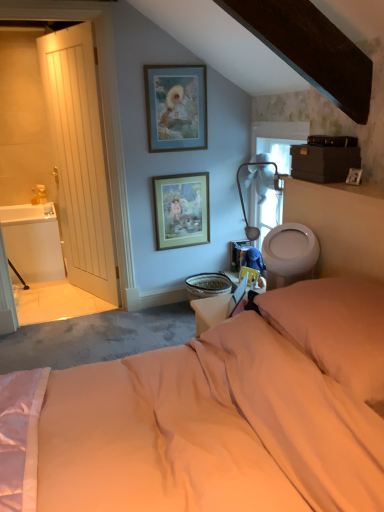
How much space does blue matte picture frame at upper center, which is the 2th picture frame in bottom-to-top order, occupy horizontally?

It is 0.93 inches.

The height and width of the screenshot is (512, 384). What do you see at coordinates (176, 106) in the screenshot? I see `blue matte picture frame at upper center, which ranks as the first picture frame in top-to-bottom order` at bounding box center [176, 106].

What do you see at coordinates (259, 185) in the screenshot? I see `white fabric lampshade at upper center` at bounding box center [259, 185].

You are a GUI agent. You are given a task and a screenshot of the screen. Output one action in this format:
    pyautogui.click(x=<x>, y=<y>)
    Task: Click on the soft pink pillow at lower right
    
    Given the screenshot: What is the action you would take?
    pyautogui.click(x=334, y=329)

Is soft pink pillow at lower right spatially inside wooden framed print at center, the 2th picture frame when ordered from top to bottom, or outside of it?

The correct answer is: outside.

Which object is further away from the camera, soft pink pillow at lower right or wooden framed print at center, the 2th picture frame when ordered from top to bottom?

wooden framed print at center, the 2th picture frame when ordered from top to bottom, is behind.

Is soft pink pillow at lower right oriented towards wooden framed print at center, the 2th picture frame when ordered from top to bottom?

No, soft pink pillow at lower right is not oriented towards wooden framed print at center, the 2th picture frame when ordered from top to bottom.

Is white glossy sink at left wider than soft pink pillow at lower right?

Yes, white glossy sink at left is wider than soft pink pillow at lower right.

Is white glossy sink at left situated inside soft pink pillow at lower right or outside?

white glossy sink at left exists outside the volume of soft pink pillow at lower right.

Is white glossy sink at left oriented away from soft pink pillow at lower right?

white glossy sink at left is not turned away from soft pink pillow at lower right.

From a real-world perspective, who is located higher, white glossy sink at left or soft pink pillow at lower right?

In real-world perspective, soft pink pillow at lower right is above.

Consider the image. Does wooden framed print at center, the 2th picture frame when ordered from top to bottom, have a greater height compared to white fabric lampshade at upper center?

Yes, wooden framed print at center, the 2th picture frame when ordered from top to bottom, is taller than white fabric lampshade at upper center.

Between wooden framed print at center, arranged as the first picture frame when ordered from the bottom, and white fabric lampshade at upper center, which one has smaller size?

wooden framed print at center, arranged as the first picture frame when ordered from the bottom.

Which object is more forward, wooden framed print at center, the 2th picture frame when ordered from top to bottom, or white fabric lampshade at upper center?

white fabric lampshade at upper center is closer to the camera.

Is wooden framed print at center, the 2th picture frame when ordered from top to bottom, facing towards white fabric lampshade at upper center?

Yes, wooden framed print at center, the 2th picture frame when ordered from top to bottom, is turned towards white fabric lampshade at upper center.

Is blue matte picture frame at upper center, which ranks as the first picture frame in top-to-bottom order, bigger than white glossy sink at left?

Actually, blue matte picture frame at upper center, which ranks as the first picture frame in top-to-bottom order, might be smaller than white glossy sink at left.

From a real-world perspective, is blue matte picture frame at upper center, which is the 2th picture frame in bottom-to-top order, under white glossy sink at left?

Actually, blue matte picture frame at upper center, which is the 2th picture frame in bottom-to-top order, is physically above white glossy sink at left in the real world.

Could white glossy sink at left be considered to be inside blue matte picture frame at upper center, which ranks as the first picture frame in top-to-bottom order?

No, white glossy sink at left is not surrounded by blue matte picture frame at upper center, which ranks as the first picture frame in top-to-bottom order.

Which object is thinner, blue matte picture frame at upper center, which ranks as the first picture frame in top-to-bottom order, or white glossy sink at left?

Thinner between the two is blue matte picture frame at upper center, which ranks as the first picture frame in top-to-bottom order.

Does white glossy sink at left have a smaller size compared to white wooden door at left?

Actually, white glossy sink at left might be larger than white wooden door at left.

Where is `door in front of the white glossy sink at left`? The image size is (384, 512). door in front of the white glossy sink at left is located at coordinates (79, 158).

Which object is more forward, white glossy sink at left or white wooden door at left?

white wooden door at left is closer to the camera.

Can you tell me how much white glossy sink at left and white wooden door at left differ in facing direction?

The angle between the facing direction of white glossy sink at left and the facing direction of white wooden door at left is 64.7 degrees.

At what (x,y) coordinates should I click in order to perform the action: click on pillow lying in front of the white glossy toilet bowl at right. Please return your answer as a coordinate pair (x, y). This screenshot has height=512, width=384. Looking at the image, I should click on (334, 329).

Is point (279, 281) positioned before point (341, 364)?

No, it is not.

Does white glossy toilet bowl at right have a lesser width compared to soft pink pillow at lower right?

Yes, white glossy toilet bowl at right is thinner than soft pink pillow at lower right.

Locate an element on the screen. The height and width of the screenshot is (512, 384). picture frame below the white fabric lampshade at upper center (from a real-world perspective) is located at coordinates (182, 210).

Is white fabric lampshade at upper center aimed at wooden framed print at center, the 2th picture frame when ordered from top to bottom?

No, white fabric lampshade at upper center is not oriented towards wooden framed print at center, the 2th picture frame when ordered from top to bottom.

From the image's perspective, which object appears higher, white fabric lampshade at upper center or wooden framed print at center, arranged as the first picture frame when ordered from the bottom?

wooden framed print at center, arranged as the first picture frame when ordered from the bottom, from the image's perspective.

What are the coordinates of `the 2nd picture frame behind the soft pink pillow at lower right, counting from the anchor's position` in the screenshot? It's located at (182, 210).

This screenshot has width=384, height=512. What are the coordinates of `sink below the soft pink pillow at lower right (from a real-world perspective)` in the screenshot? It's located at (33, 241).

From the image, which object appears to be farther from white glossy sink at left, soft pink pillow at lower right or white wooden door at left?

soft pink pillow at lower right lies further to white glossy sink at left than the other object.

Considering their positions, is blue matte picture frame at upper center, which is the 2th picture frame in bottom-to-top order, positioned further to white wooden door at left than wooden framed print at center, the 2th picture frame when ordered from top to bottom?

Based on the image, blue matte picture frame at upper center, which is the 2th picture frame in bottom-to-top order, appears to be further to white wooden door at left.

In the scene shown: Which object lies nearer to the anchor point white glossy toilet bowl at right, soft pink pillow at lower right or white fabric lampshade at upper center?

Among the two, soft pink pillow at lower right is located nearer to white glossy toilet bowl at right.

Estimate the real-world distances between objects in this image. Which object is further from white glossy toilet bowl at right, white fabric lampshade at upper center or white wooden door at left?

white wooden door at left is positioned further to the anchor white glossy toilet bowl at right.

Based on their spatial positions, is white glossy toilet bowl at right or wooden framed print at center, the 2th picture frame when ordered from top to bottom, further from soft pink pillow at lower right?

wooden framed print at center, the 2th picture frame when ordered from top to bottom, is positioned further to the anchor soft pink pillow at lower right.

Based on their spatial positions, is white wooden door at left or blue matte picture frame at upper center, which ranks as the first picture frame in top-to-bottom order, closer to white glossy sink at left?

Among the two, white wooden door at left is located nearer to white glossy sink at left.

From the image, which object appears to be nearer to soft pink pillow at lower right, wooden framed print at center, the 2th picture frame when ordered from top to bottom, or white glossy sink at left?

wooden framed print at center, the 2th picture frame when ordered from top to bottom, is positioned closer to the anchor soft pink pillow at lower right.

Looking at the image, which one is located closer to white fabric lampshade at upper center, white glossy toilet bowl at right or blue matte picture frame at upper center, which ranks as the first picture frame in top-to-bottom order?

blue matte picture frame at upper center, which ranks as the first picture frame in top-to-bottom order, is positioned closer to the anchor white fabric lampshade at upper center.

Locate an element on the screen. This screenshot has height=512, width=384. table lamp between white glossy toilet bowl at right and blue matte picture frame at upper center, which is the 2th picture frame in bottom-to-top order, along the z-axis is located at coordinates (259, 185).

I want to click on picture frame positioned between white glossy toilet bowl at right and wooden framed print at center, the 2th picture frame when ordered from top to bottom, from near to far, so click(176, 106).

I want to click on door located between soft pink pillow at lower right and wooden framed print at center, the 2th picture frame when ordered from top to bottom, in the depth direction, so [x=79, y=158].

Find the location of a particular element. The image size is (384, 512). toilet bowl located between soft pink pillow at lower right and blue matte picture frame at upper center, which is the 2th picture frame in bottom-to-top order, in the depth direction is located at coordinates (289, 254).